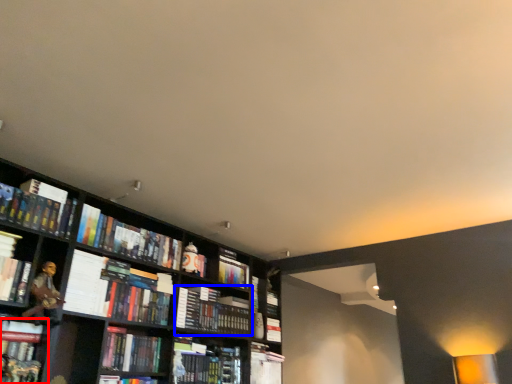
Question: Which object is further to the camera taking this photo, book (highlighted by a red box) or book (highlighted by a blue box)?

Choices:
 (A) book
 (B) book

Answer: (B)